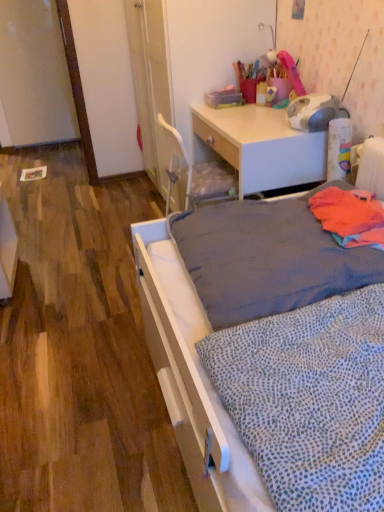
Where is `blank space situated above white glossy desk at upper center (from a real-world perspective)`? This screenshot has height=512, width=384. blank space situated above white glossy desk at upper center (from a real-world perspective) is located at coordinates (250, 118).